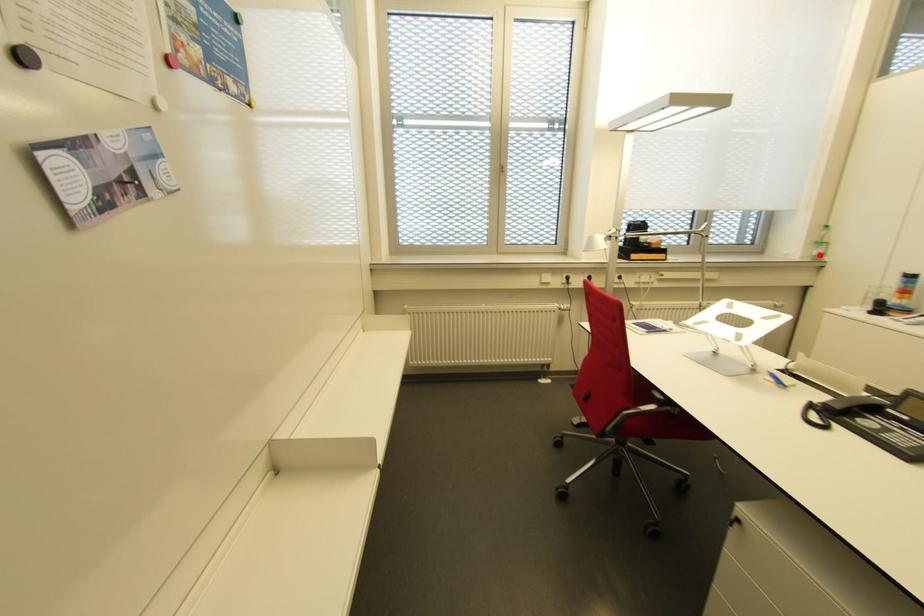
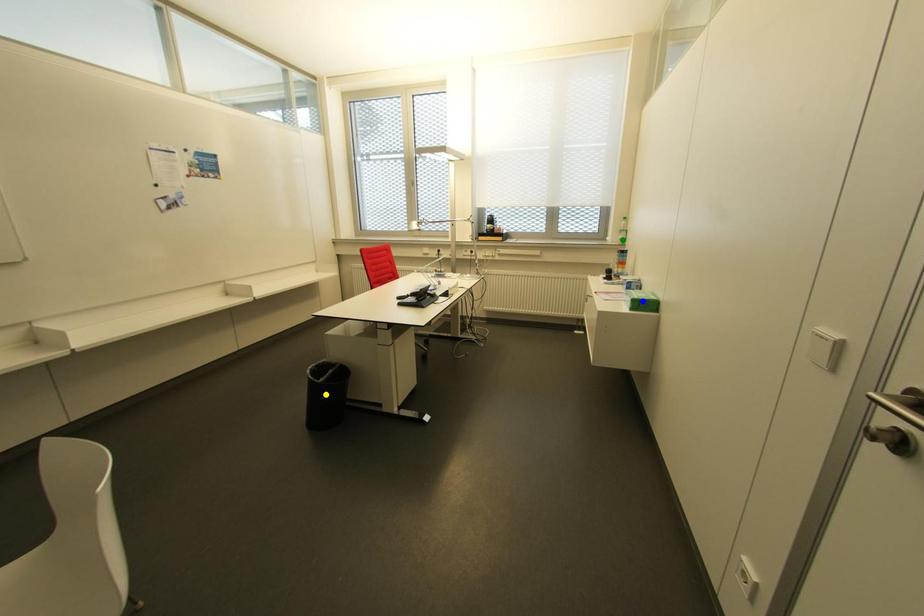
Question: I am providing you with two images of the same scene from different viewpoints. A red point is marked on the first image. You are given multiple points on the second image. In image 2, which mark is for the same physical point as the one in image 1?

Choices:
 (A) green point
 (B) yellow point
 (C) blue point

Answer: (A)